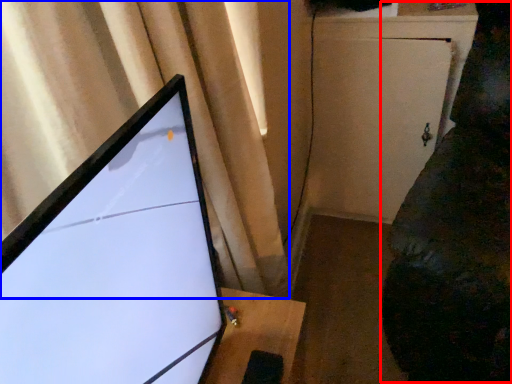
Question: Which point is further to the camera, couch (highlighted by a red box) or curtain (highlighted by a blue box)?

Choices:
 (A) couch
 (B) curtain

Answer: (A)